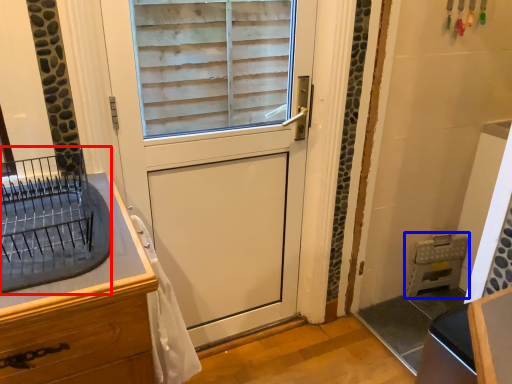
Question: Which object appears farthest to the camera in this image, appliance (highlighted by a red box) or appliance (highlighted by a blue box)?

Choices:
 (A) appliance
 (B) appliance

Answer: (B)